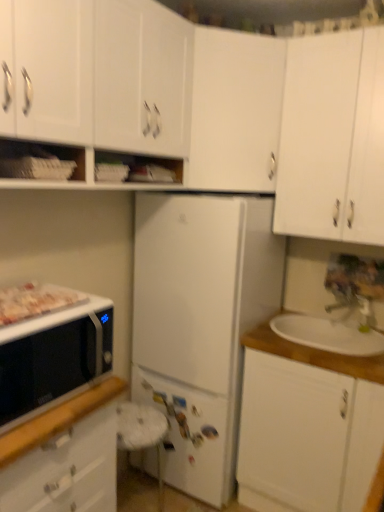
Where is `vacant space situated above white wood sink at right (from a real-world perspective)`? This screenshot has height=512, width=384. vacant space situated above white wood sink at right (from a real-world perspective) is located at coordinates (328, 329).